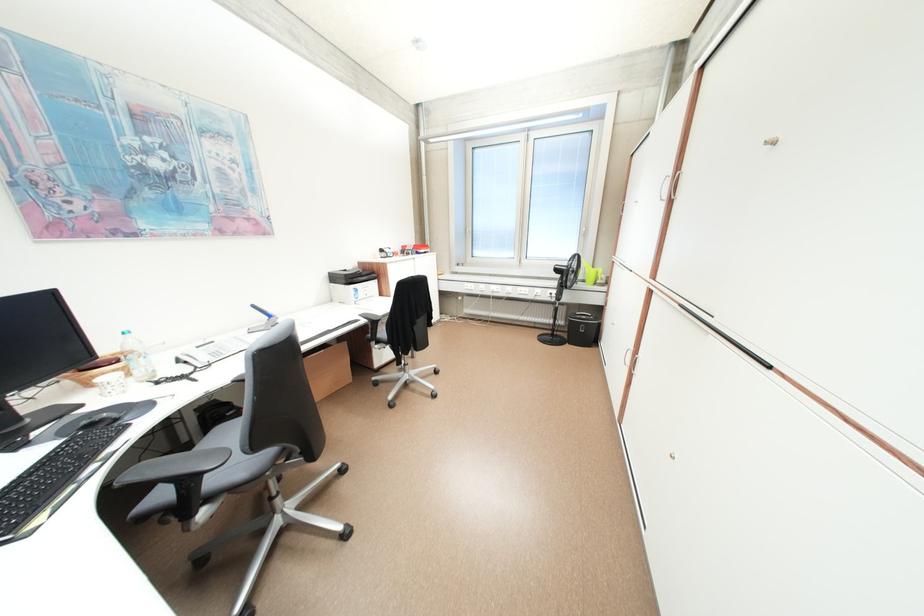
At what (x,y) coordinates should I click in order to perform the action: click on window handle. Please return your answer as a coordinate pair (x, y). Image resolution: width=924 pixels, height=616 pixels. Looking at the image, I should click on (584, 231).